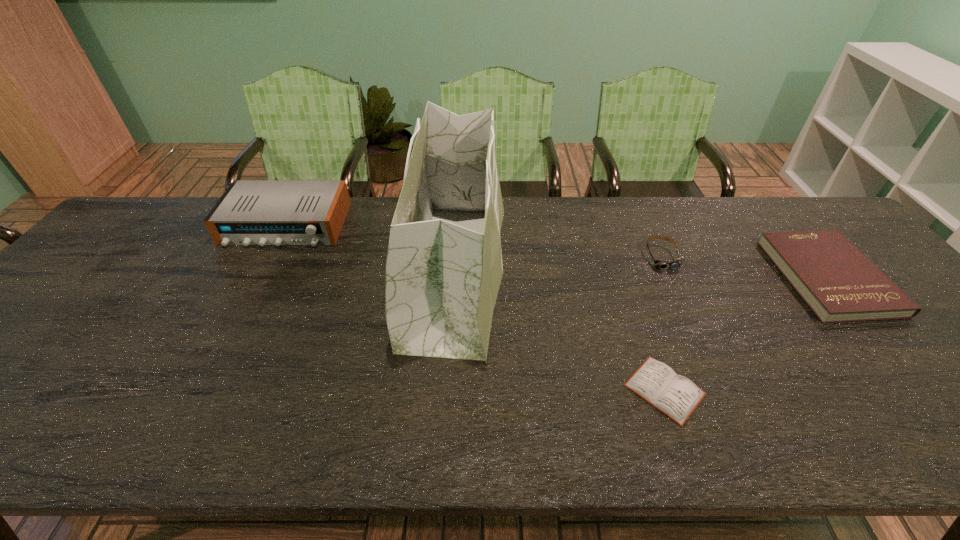
Where is `unoccupied position between the diary and the rightmost object`? unoccupied position between the diary and the rightmost object is located at coordinates (747, 334).

Where is `free spot between the tallest object and the goggles`? Image resolution: width=960 pixels, height=540 pixels. free spot between the tallest object and the goggles is located at coordinates (559, 264).

In order to click on vacant space in between the rightmost object and the shortest object in this screenshot , I will do `click(747, 334)`.

The width and height of the screenshot is (960, 540). What are the coordinates of `vacant point located between the shortest object and the tallest object` in the screenshot? It's located at (561, 331).

Locate which object ranks fourth in proximity to the goggles. Please provide its 2D coordinates. Your answer should be formatted as a tuple, i.e. [(x, y)], where the tuple contains the x and y coordinates of a point satisfying the conditions above.

[(250, 212)]

Find the location of a particular element. This screenshot has height=540, width=960. object that is the closest to the rightmost object is located at coordinates (677, 263).

Image resolution: width=960 pixels, height=540 pixels. I want to click on free point that satisfies the following two spatial constraints: 1. on the front-facing side of the hardback book; 2. on the right side of the goggles, so click(x=672, y=278).

The width and height of the screenshot is (960, 540). Identify the location of vacant area that satisfies the following two spatial constraints: 1. on the back side of the hardback book; 2. on the left side of the shortest object. (626, 278).

Locate an element on the screen. This screenshot has width=960, height=540. free spot that satisfies the following two spatial constraints: 1. on the back side of the hardback book; 2. on the right side of the diary is located at coordinates pos(626,278).